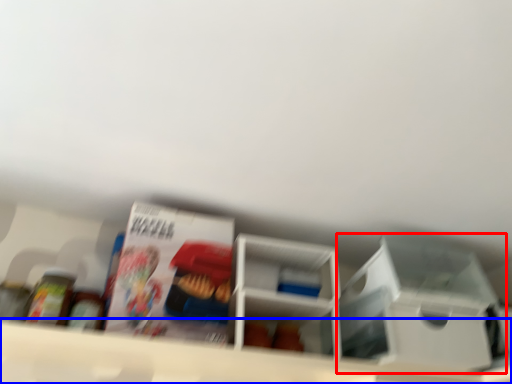
Question: Which object is further to the camera taking this photo, storage box (highlighted by a red box) or shelf (highlighted by a blue box)?

Choices:
 (A) storage box
 (B) shelf

Answer: (A)